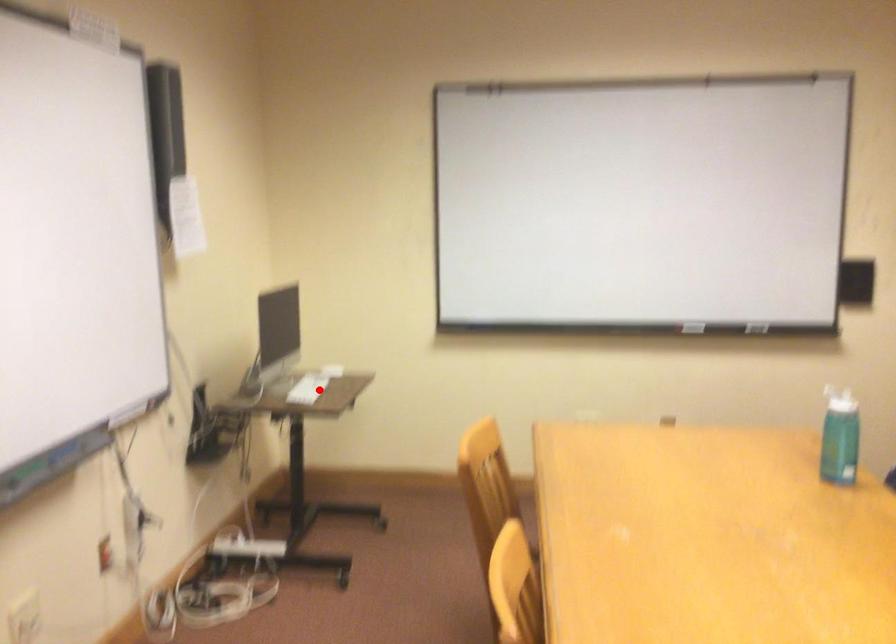
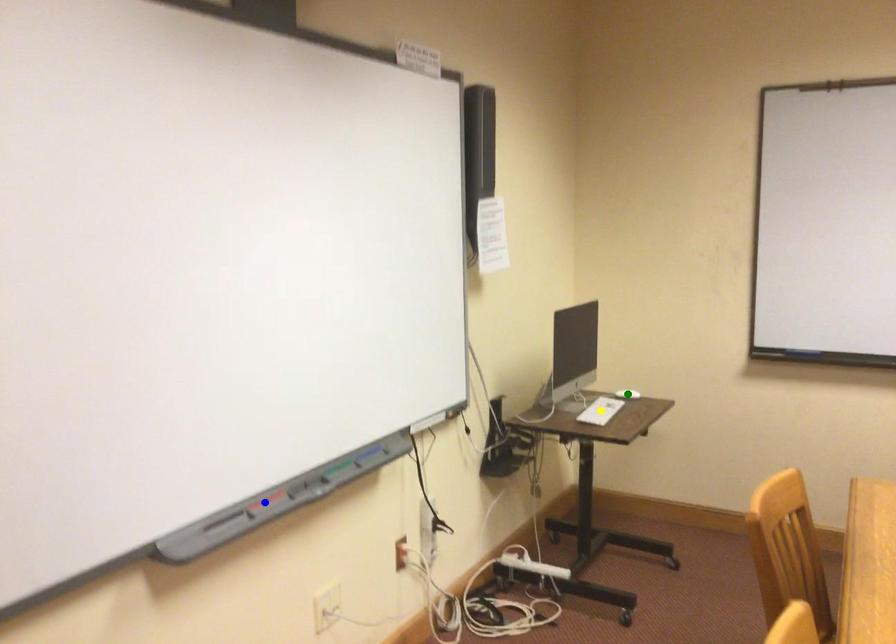
Question: I am providing you with two images of the same scene from different viewpoints. A red point is marked on the first image. You are given multiple points on the second image. Can you choose the point in image 2 that corresponds to the point in image 1?

Choices:
 (A) blue point
 (B) green point
 (C) yellow point

Answer: (C)